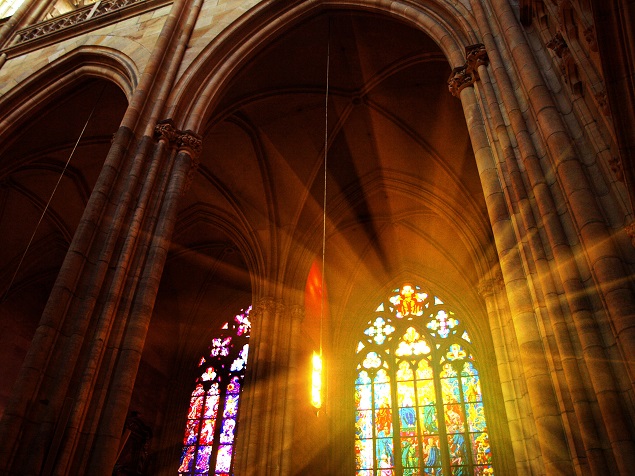
You are a GUI agent. You are given a task and a screenshot of the screen. Output one action in this format:
    pyautogui.click(x=<x>, y=<y>)
    Task: Click on the sun beams, right side above window
    
    Given the screenshot: What is the action you would take?
    pyautogui.click(x=324, y=209), pyautogui.click(x=377, y=187), pyautogui.click(x=425, y=178), pyautogui.click(x=512, y=178)